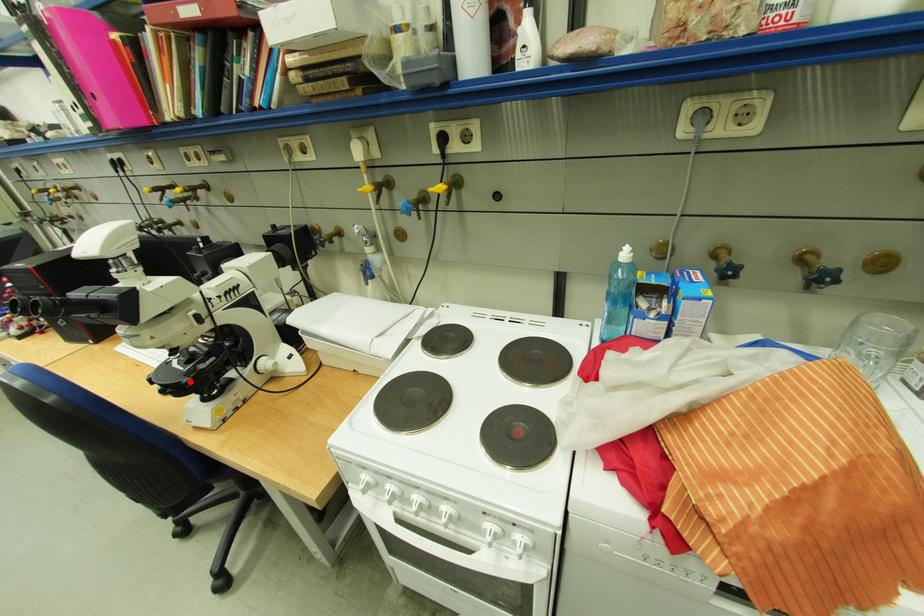
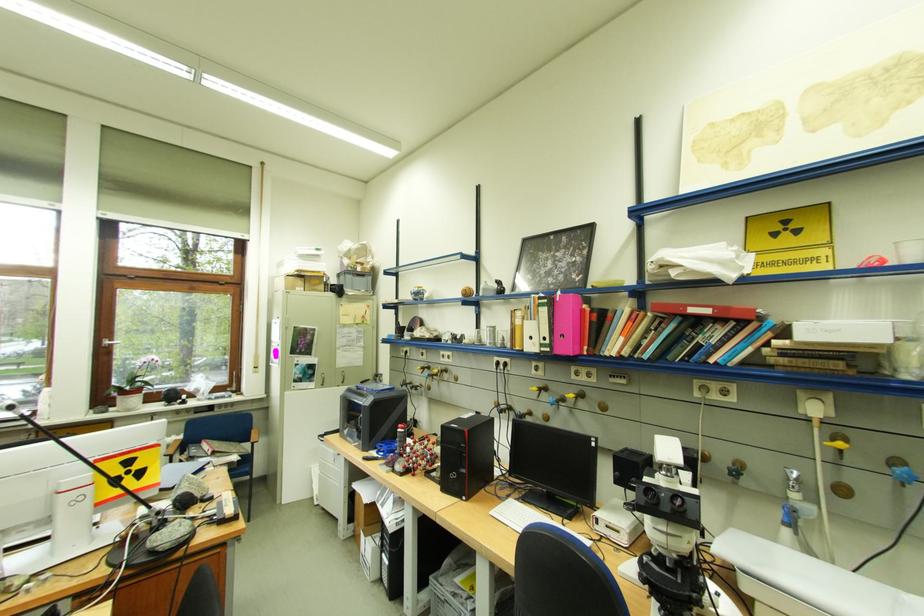
In the second image, find the point that corresponds to the highlighted location in the first image.

(698, 594)